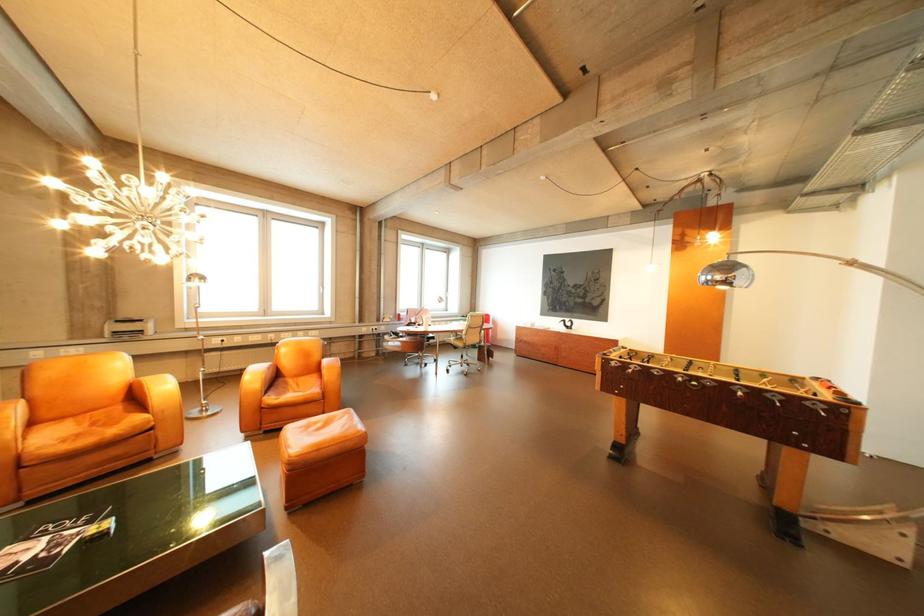
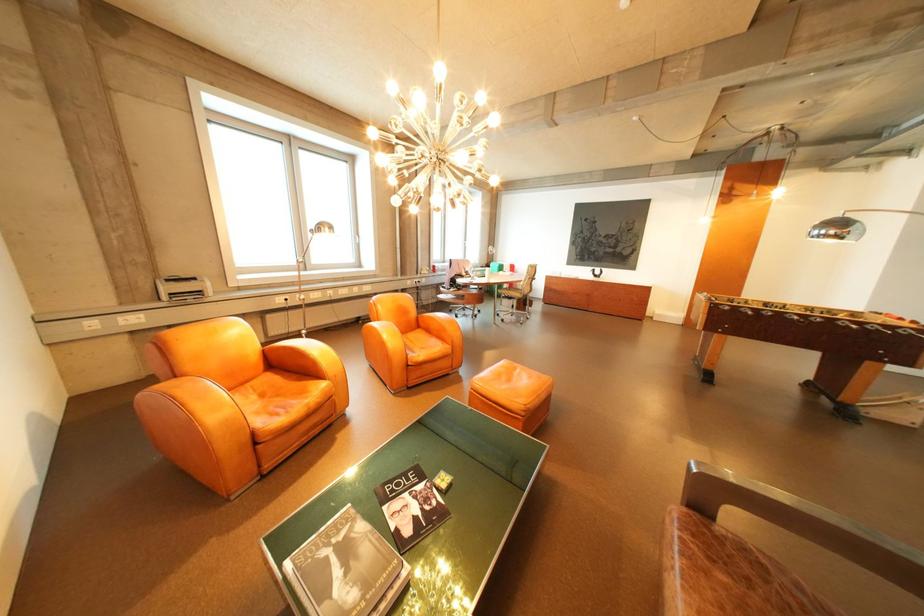
Where in the second image is the point corresponding to (155,321) from the first image?

(208, 280)